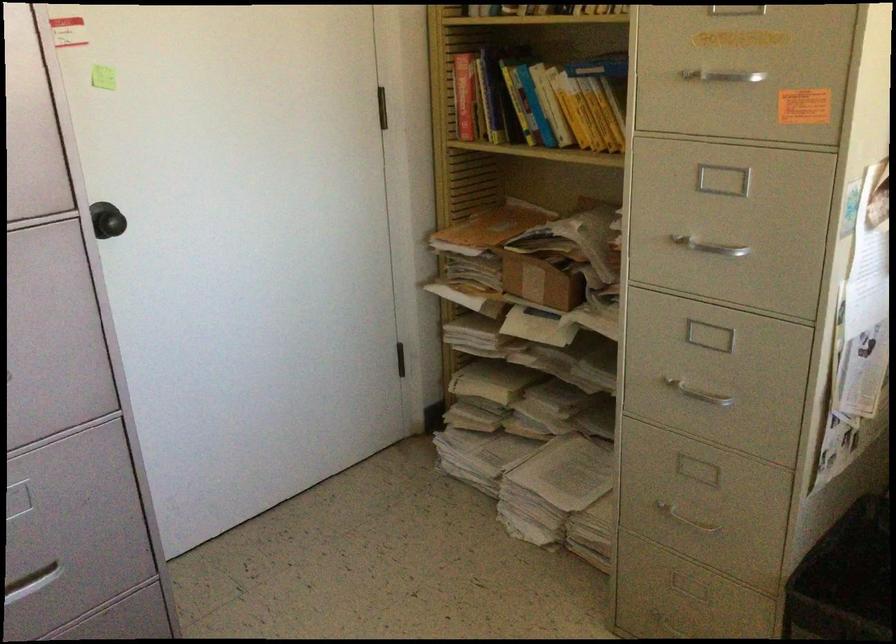
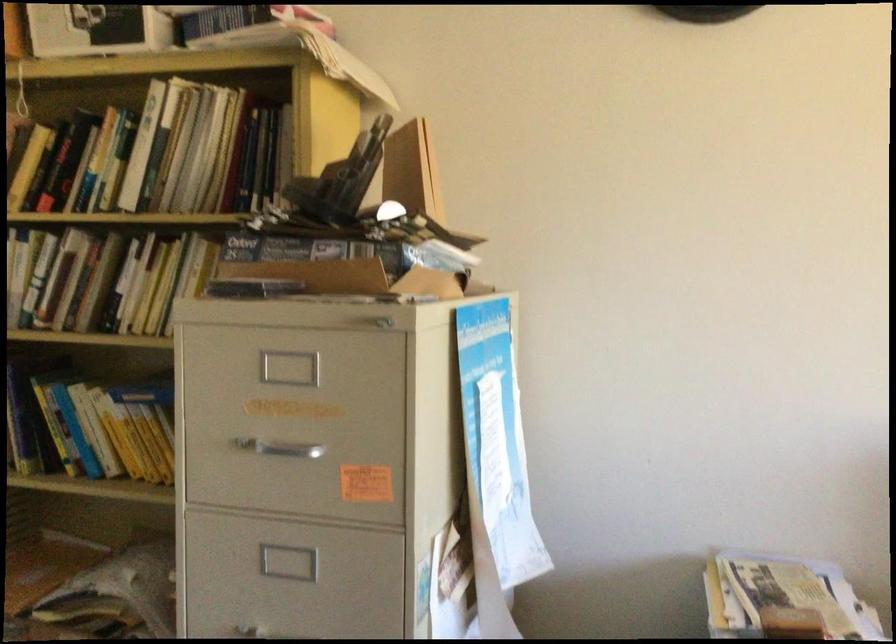
Question: How did the camera likely rotate?

Choices:
 (A) Left
 (B) Right
 (C) Up
 (D) Down

Answer: (B)